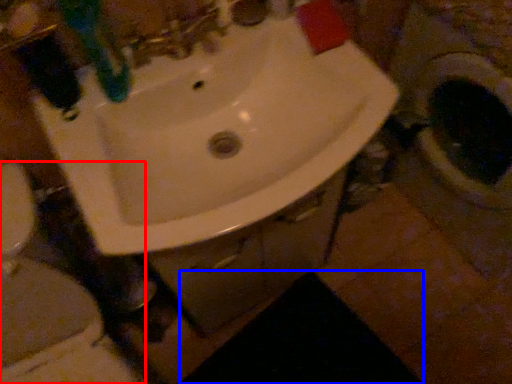
Question: Which object appears farthest to the camera in this image, toilet (highlighted by a red box) or dark (highlighted by a blue box)?

Choices:
 (A) toilet
 (B) dark

Answer: (B)